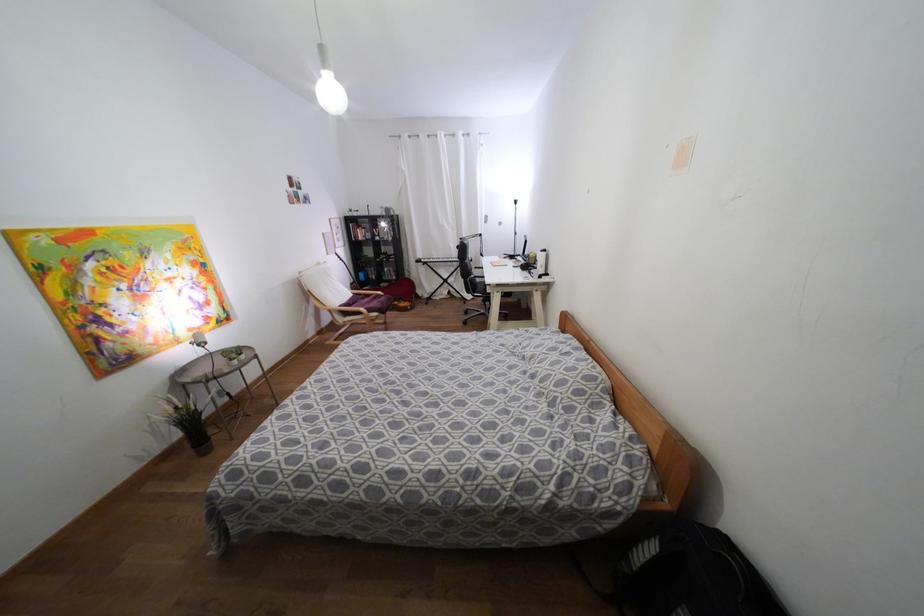
Where would you resting arm the chair armrest? Please return your answer as a coordinate pair (x, y).

(345, 312)